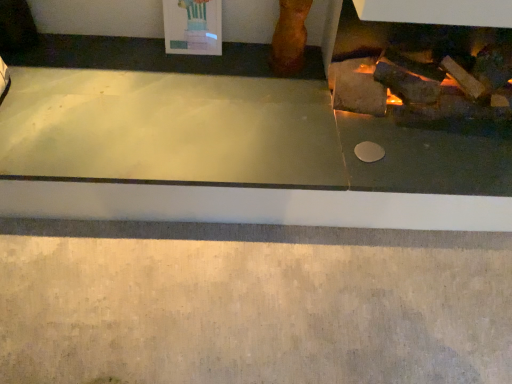
Find the location of a particular element. This screenshot has height=384, width=512. free spot above smooth concrete at lower center (from a real-world perspective) is located at coordinates (176, 299).